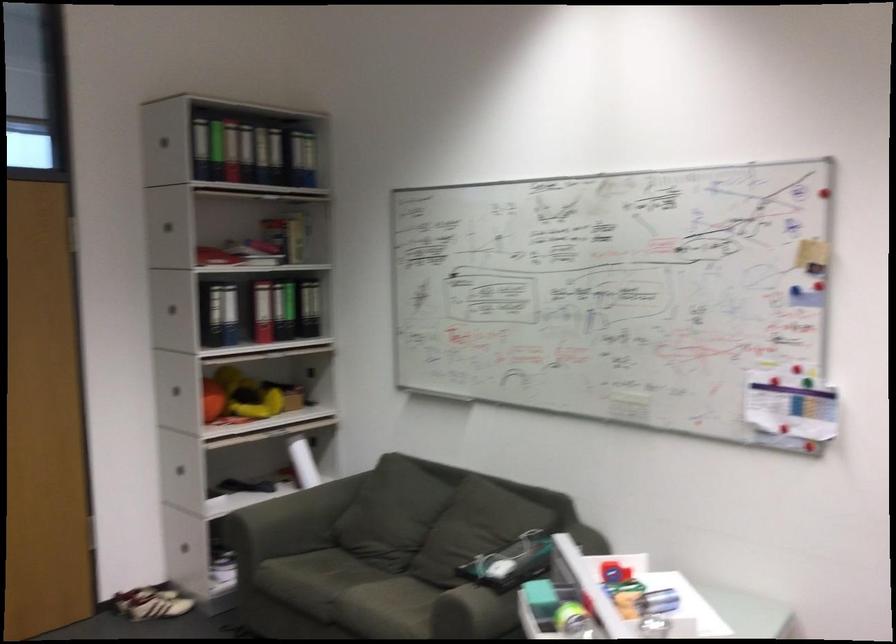
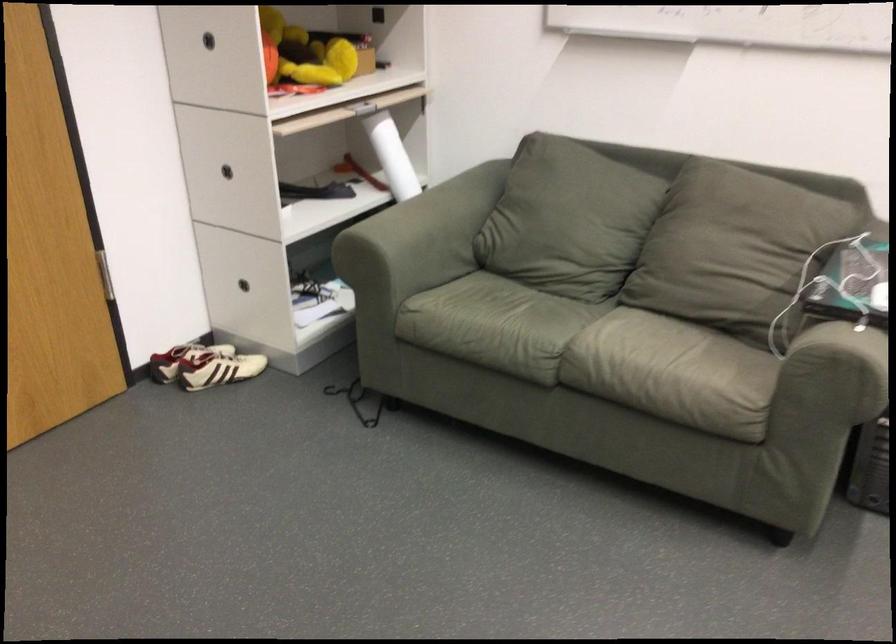
In the second image, find the point that corresponds to point 176,478 in the first image.

(227, 171)